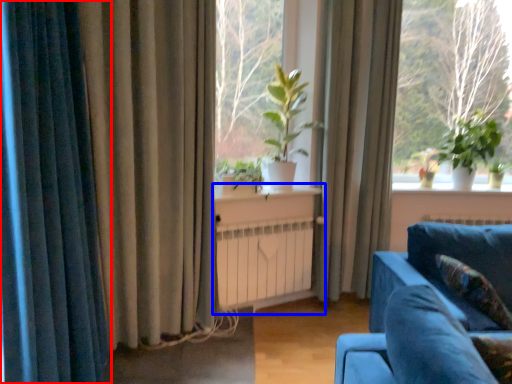
Question: Among these objects, which one is farthest to the camera, curtain (highlighted by a red box) or table (highlighted by a blue box)?

Choices:
 (A) curtain
 (B) table

Answer: (B)